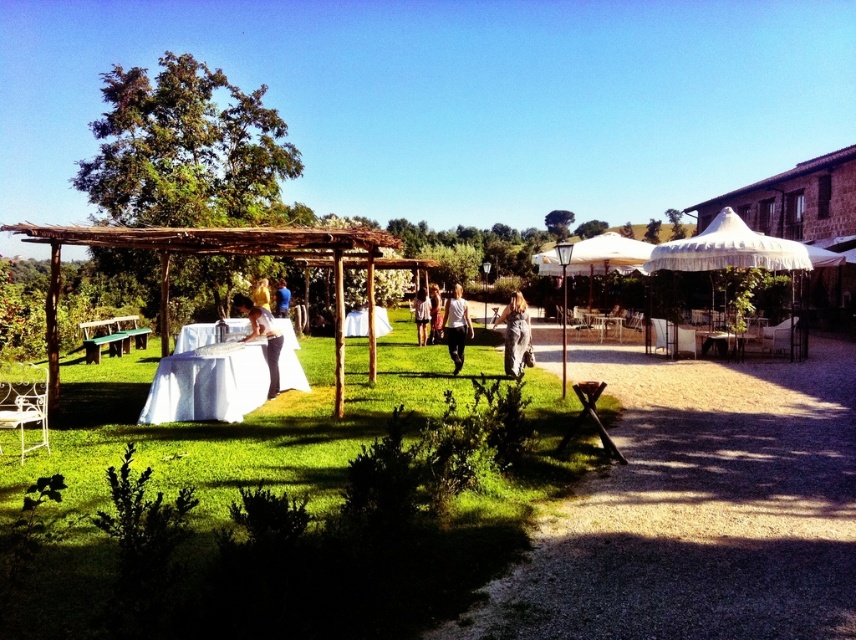
Question: Estimate the real-world distances between objects in this image. Which object is closer to the wooden pergola at left?

Choices:
 (A) white cotton dress at center
 (B) blue fabric shirt at center

Answer: (B)

Question: Is white matte shirt at center in front of golden hair at center?

Choices:
 (A) no
 (B) yes

Answer: (B)

Question: Which of the following is the farthest from the observer?

Choices:
 (A) matte white tablecloth at center
 (B) white fabric umbrella at center-right
 (C) blue fabric shirt at center

Answer: (C)

Question: Is white wrought iron chair at lower left in front of light brown wooden chair at center?

Choices:
 (A) yes
 (B) no

Answer: (A)

Question: Which point is farther to the camera?

Choices:
 (A) (509, 372)
 (B) (437, 332)
 (C) (30, 388)

Answer: (B)

Question: Does white cotton dress at center come behind blue fabric shirt at center?

Choices:
 (A) yes
 (B) no

Answer: (B)